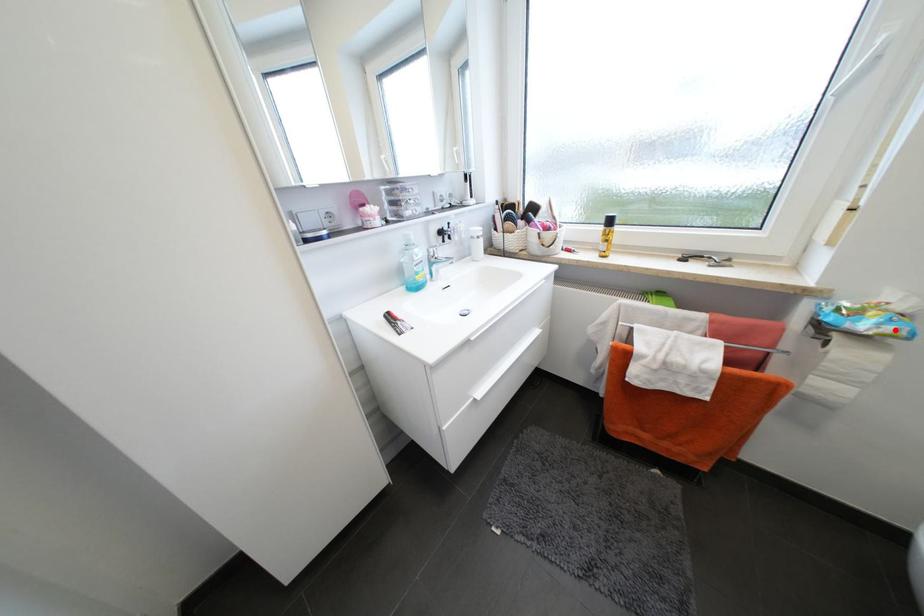
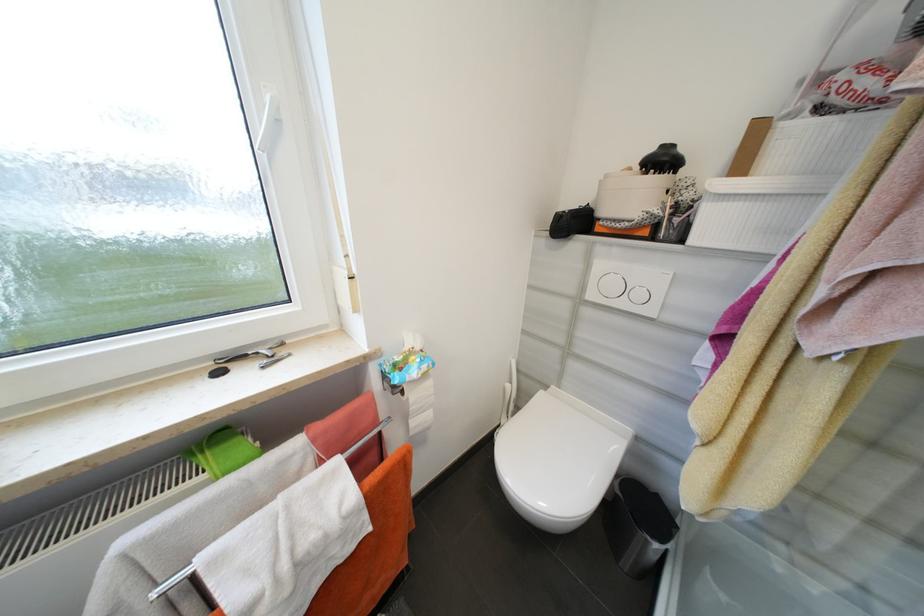
The point at the highlighted location is marked in the first image. Where is the corresponding point in the second image?

(430, 368)